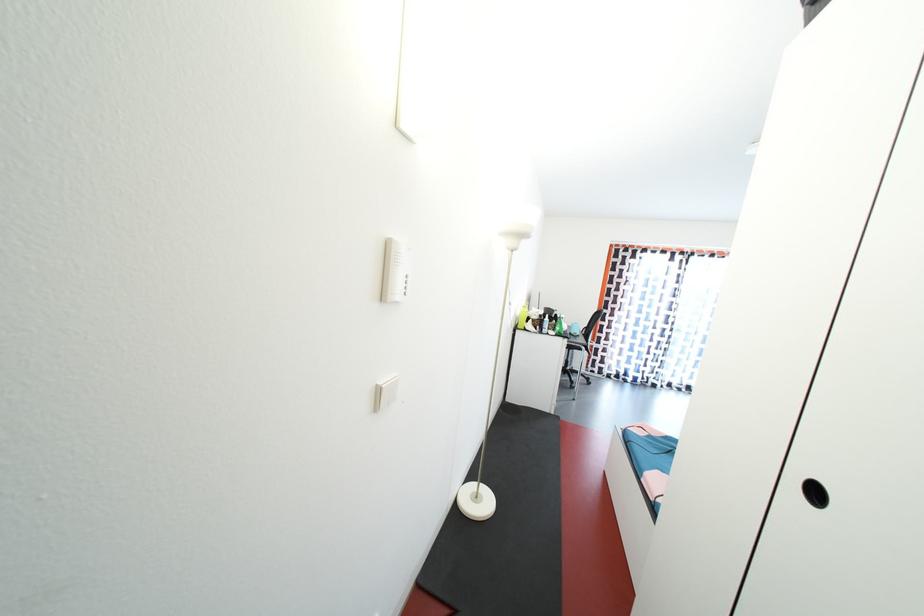
Find where to push the intercom buttons. Please return your answer as a coordinate pair (x, y).

(406, 285)